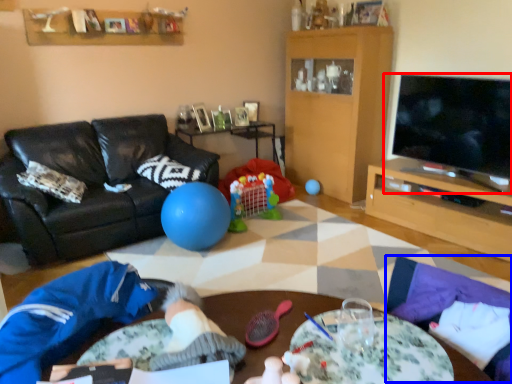
Question: Which of the following is the farthest to the observer, television (highlighted by a red box) or flat (highlighted by a blue box)?

Choices:
 (A) television
 (B) flat

Answer: (A)